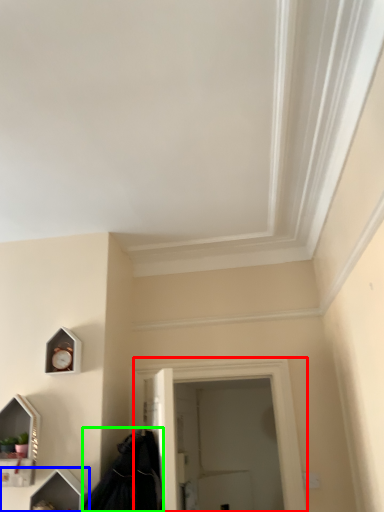
Question: Estimate the real-world distances between objects in this image. Which object is farther from window (highlighted by a red box), vanity (highlighted by a blue box) or cloak (highlighted by a green box)?

Choices:
 (A) vanity
 (B) cloak

Answer: (A)